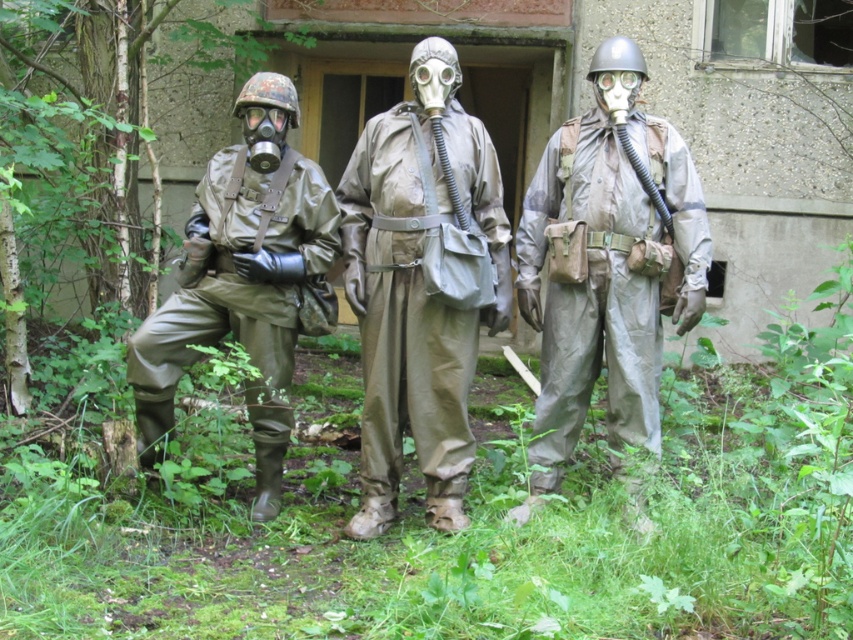
Question: Based on their relative distances, which object is farther from the matte khaki gas mask at center?

Choices:
 (A) matte green rubber suit at left
 (B) camouflage fabric suit at center

Answer: (B)

Question: Which point is closer to the camera taking this photo?

Choices:
 (A) (572, 420)
 (B) (317, 212)
 (C) (375, 243)

Answer: (C)

Question: Is matte khaki gas mask at center further to camera compared to camouflage fabric suit at center?

Choices:
 (A) no
 (B) yes

Answer: (B)

Question: Among these objects, which one is farthest from the camera?

Choices:
 (A) matte khaki gas mask at center
 (B) matte green rubber suit at left
 (C) camouflage fabric suit at center

Answer: (B)

Question: Does camouflage fabric suit at center have a smaller size compared to matte green rubber suit at left?

Choices:
 (A) yes
 (B) no

Answer: (B)

Question: Is matte khaki gas mask at center bigger than matte green rubber suit at left?

Choices:
 (A) yes
 (B) no

Answer: (B)